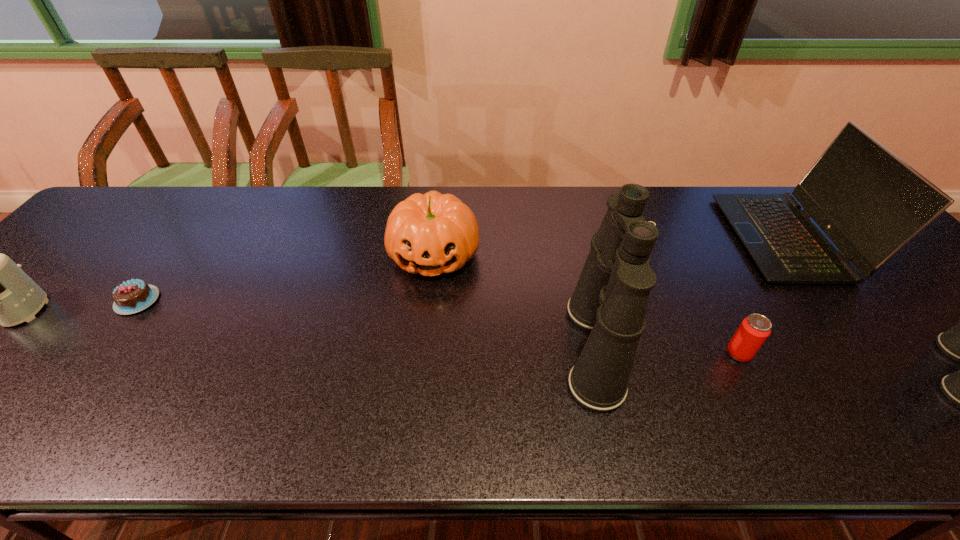
You are a GUI agent. You are given a task and a screenshot of the screen. Output one action in this format:
    pyautogui.click(x=<x>, y=<y>)
    Task: Click on the tallest object
    This screenshot has width=960, height=540.
    Given the screenshot: What is the action you would take?
    pyautogui.click(x=610, y=300)

Identify the location of the taller binoculars. The image size is (960, 540). (610, 300).

At what (x,y) coordinates should I click in order to perform the action: click on laptop computer. Please return your answer as a coordinate pair (x, y). Looking at the image, I should click on pos(870,203).

Find the location of a particular element. the fifth object from right to left is located at coordinates (432, 233).

This screenshot has height=540, width=960. Identify the location of the fifth tallest object. click(432, 233).

The image size is (960, 540). In order to click on chocolate cake in this screenshot , I will do (133, 296).

Locate an element on the screen. the shortest object is located at coordinates (133, 296).

In order to click on beer can in this screenshot , I will do `click(753, 331)`.

I want to click on the second shortest object, so click(753, 331).

Identify the location of vacant space situated on the left of the fourth object from right to left. The image size is (960, 540). (502, 348).